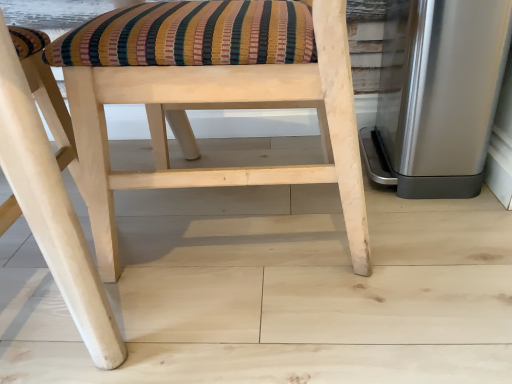
Question: Is natural wood chair at center, the 2th chair from the right, positioned far away from natural wood chair at center, which ranks as the second chair in left-to-right order?

Choices:
 (A) no
 (B) yes

Answer: (A)

Question: Does natural wood chair at center, which appears as the 1th chair when viewed from the left, have a lesser width compared to natural wood chair at center, which appears as the 1th chair when viewed from the right?

Choices:
 (A) yes
 (B) no

Answer: (B)

Question: From a real-world perspective, is natural wood chair at center, the 2th chair from the right, below natural wood chair at center, which ranks as the second chair in left-to-right order?

Choices:
 (A) no
 (B) yes

Answer: (A)

Question: From the image's perspective, is natural wood chair at center, which appears as the 1th chair when viewed from the left, on natural wood chair at center, which ranks as the second chair in left-to-right order?

Choices:
 (A) yes
 (B) no

Answer: (B)

Question: Is the position of natural wood chair at center, which appears as the 1th chair when viewed from the left, more distant than that of natural wood chair at center, which appears as the 1th chair when viewed from the right?

Choices:
 (A) no
 (B) yes

Answer: (A)

Question: From the image's perspective, relative to natural wood chair at center, which appears as the 1th chair when viewed from the right, is satin silver trash can at right above or below?

Choices:
 (A) below
 (B) above

Answer: (B)

Question: Is satin silver trash can at right spatially inside natural wood chair at center, which appears as the 1th chair when viewed from the right, or outside of it?

Choices:
 (A) outside
 (B) inside

Answer: (A)

Question: Would you say satin silver trash can at right is to the left or to the right of natural wood chair at center, which ranks as the second chair in left-to-right order, in the picture?

Choices:
 (A) right
 (B) left

Answer: (A)

Question: Is satin silver trash can at right bigger or smaller than natural wood chair at center, which appears as the 1th chair when viewed from the right?

Choices:
 (A) big
 (B) small

Answer: (B)

Question: Looking at their shapes, would you say natural wood chair at center, the 2th chair from the right, is wider or thinner than natural wood chair at center, which appears as the 1th chair when viewed from the right?

Choices:
 (A) thin
 (B) wide

Answer: (B)

Question: From a real-world perspective, is natural wood chair at center, the 2th chair from the right, physically located above or below natural wood chair at center, which ranks as the second chair in left-to-right order?

Choices:
 (A) below
 (B) above

Answer: (B)

Question: Which is correct: natural wood chair at center, which appears as the 1th chair when viewed from the left, is inside natural wood chair at center, which appears as the 1th chair when viewed from the right, or outside of it?

Choices:
 (A) inside
 (B) outside

Answer: (B)

Question: Relative to natural wood chair at center, which ranks as the second chair in left-to-right order, is natural wood chair at center, which appears as the 1th chair when viewed from the left, in front or behind?

Choices:
 (A) behind
 (B) front

Answer: (B)

Question: From the image's perspective, is natural wood chair at center, which ranks as the second chair in left-to-right order, above or below satin silver trash can at right?

Choices:
 (A) below
 (B) above

Answer: (A)

Question: Is natural wood chair at center, which appears as the 1th chair when viewed from the right, spatially inside satin silver trash can at right, or outside of it?

Choices:
 (A) inside
 (B) outside

Answer: (B)